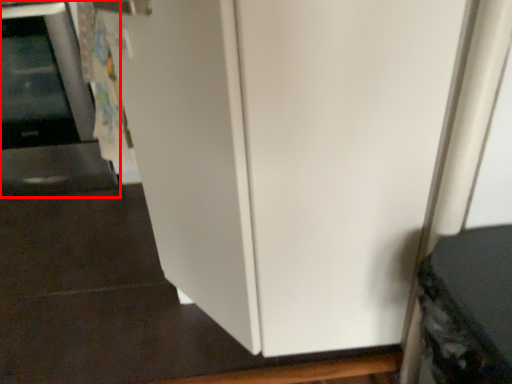
Question: Observing the image, what is the correct spatial positioning of appliance (annotated by the red box) in reference to appliance?

Choices:
 (A) right
 (B) left

Answer: (B)